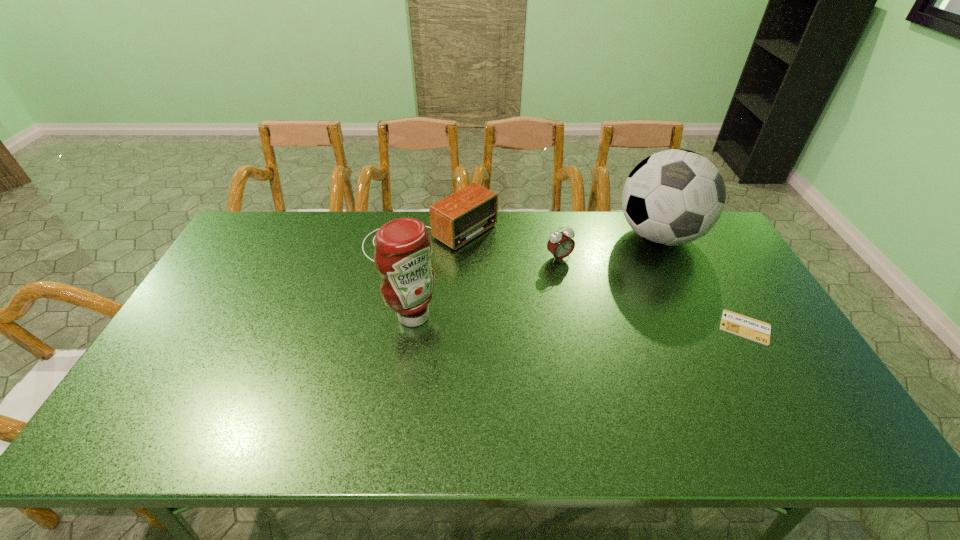
Find the location of a particular element. Image resolution: width=960 pixels, height=540 pixels. unoccupied position between the identity card and the third object from right to left is located at coordinates (652, 293).

Locate an element on the screen. This screenshot has width=960, height=540. empty space that is in between the radio receiver and the third object from left to right is located at coordinates (495, 247).

The height and width of the screenshot is (540, 960). In order to click on unoccupied area between the third object from left to right and the condiment in this screenshot , I will do `click(487, 287)`.

Find the location of a particular element. free spot between the shortest object and the radio receiver is located at coordinates 588,282.

Find the location of a particular element. The height and width of the screenshot is (540, 960). vacant area that lies between the soccer ball and the condiment is located at coordinates pyautogui.click(x=536, y=276).

The image size is (960, 540). I want to click on blank region between the soccer ball and the third object from right to left, so click(x=609, y=247).

At what (x,y) coordinates should I click in order to perform the action: click on object that ranks as the fourth closest to the radio receiver. Please return your answer as a coordinate pair (x, y). The image size is (960, 540). Looking at the image, I should click on (732, 322).

You are a GUI agent. You are given a task and a screenshot of the screen. Output one action in this format:
    pyautogui.click(x=<x>, y=<y>)
    Task: Click on the fourth closest object to the alarm clock
    The height and width of the screenshot is (540, 960).
    Given the screenshot: What is the action you would take?
    pyautogui.click(x=732, y=322)

Where is `vacant space that satisfies the following two spatial constraints: 1. on the front side of the radio receiver; 2. on the left side of the shortest object`? vacant space that satisfies the following two spatial constraints: 1. on the front side of the radio receiver; 2. on the left side of the shortest object is located at coordinates (420, 327).

Locate an element on the screen. free spot that satisfies the following two spatial constraints: 1. on the front side of the radio receiver; 2. on the left side of the alarm clock is located at coordinates click(x=429, y=258).